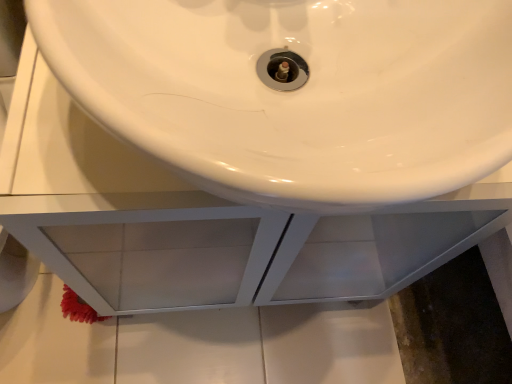
At what (x,y) coordinates should I click in order to perform the action: click on white glossy sink at center. Please return your answer as a coordinate pair (x, y). The height and width of the screenshot is (384, 512). Looking at the image, I should click on coord(296,92).

What do you see at coordinates (296, 92) in the screenshot?
I see `white glossy sink at center` at bounding box center [296, 92].

Image resolution: width=512 pixels, height=384 pixels. In order to click on white glossy sink at center in this screenshot , I will do `click(296, 92)`.